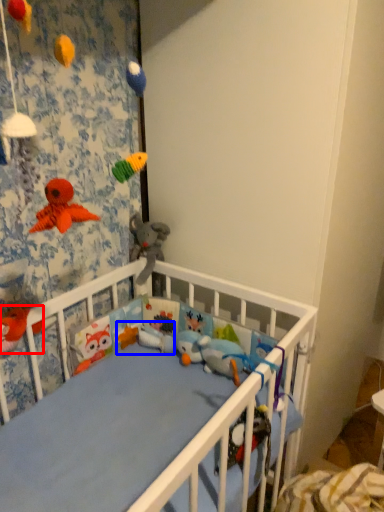
Question: Which object is closer to the camera taking this photo, toy (highlighted by a red box) or toy (highlighted by a blue box)?

Choices:
 (A) toy
 (B) toy

Answer: (A)